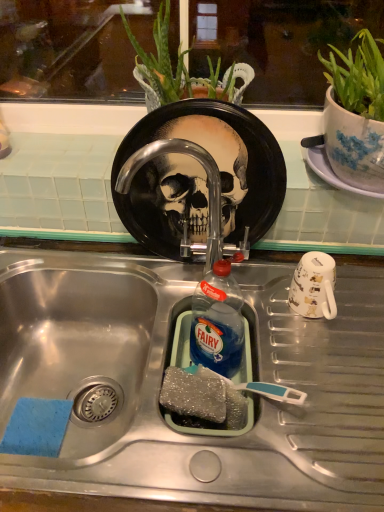
Question: Is point (162, 70) closer or farther from the camera than point (321, 295)?

Choices:
 (A) closer
 (B) farther

Answer: (B)

Question: Relative to white glossy mug at right, is green leafy plant at center in front or behind?

Choices:
 (A) front
 (B) behind

Answer: (A)

Question: Estimate the real-world distances between objects in this image. Which object is farther from the stainless steel sink at center?

Choices:
 (A) blue translucent liquid at sink center
 (B) green leafy plant at center
 (C) sparkly gray sponge at sink bottom
 (D) white glossy mug at right
 (E) black glossy plate at center

Answer: (B)

Question: Estimate the real-world distances between objects in this image. Which object is farther from the blue translucent liquid at sink center?

Choices:
 (A) sparkly gray sponge at sink bottom
 (B) green leafy plant at center
 (C) black glossy plate at center
 (D) stainless steel sink at center
 (E) white glossy mug at right

Answer: (B)